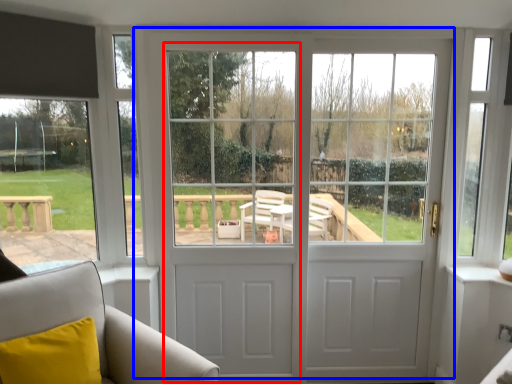
Question: Which of the following is the farthest to the observer, screen door (highlighted by a red box) or door (highlighted by a blue box)?

Choices:
 (A) screen door
 (B) door

Answer: (B)